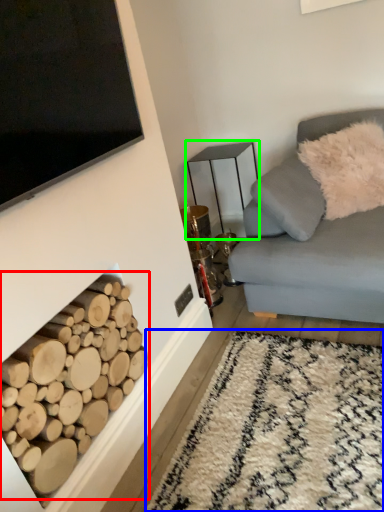
Question: Considering the real-world distances, which object is farthest from driftwood (highlighted by a red box)? plain (highlighted by a blue box) or table (highlighted by a green box)?

Choices:
 (A) plain
 (B) table

Answer: (B)